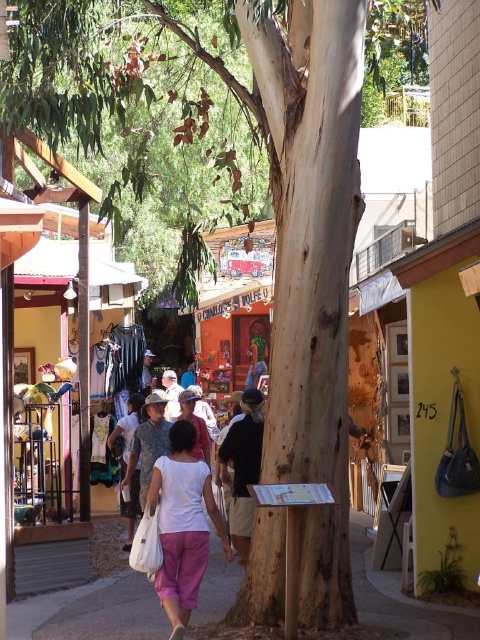
You are a delivery person carrying a heavy box and need to walk on the smooth concrete sidewalk at center. However, there is a white cotton shirt at center in your path. Can you step over or around it without disturbing the shirt?

The white cotton shirt at center is behind the smooth concrete sidewalk at center, meaning it is not on the sidewalk itself. Therefore, you can walk on the smooth concrete sidewalk at center without disturbing the shirt as it is located behind the sidewalk.

You are standing in the shopping area and want to take a photo of the point at coordinates (352, 580). If your camera has a maximum focus range of 8 meters, will it be able to focus on that point?

The point at coordinates (352, 580) is 8.66 meters away from the camera, which exceeds the maximum focus range of 8 meters. Therefore, the camera cannot focus on that point.